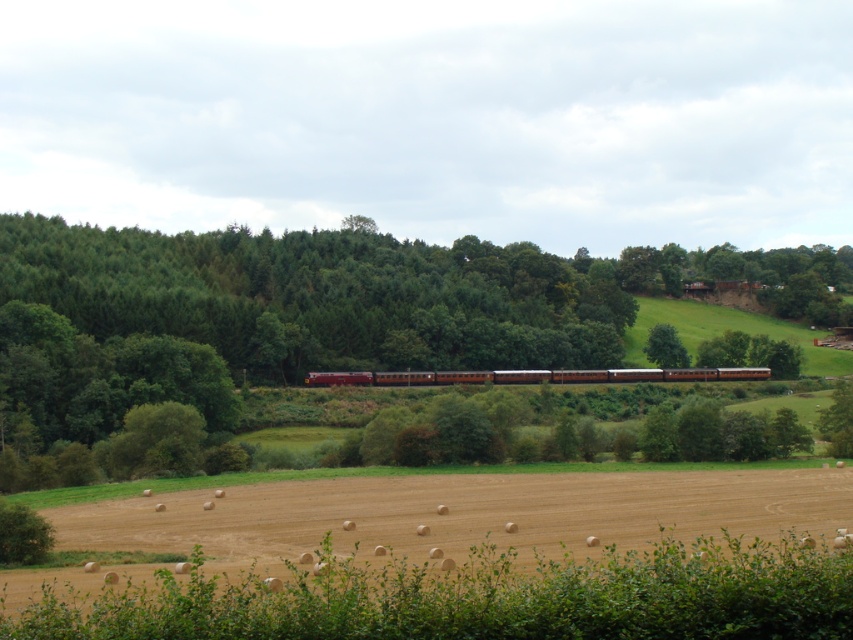
Question: Can you confirm if brown polished wood passenger train at center is positioned above green leafy tree at upper center?

Choices:
 (A) no
 (B) yes

Answer: (A)

Question: Can you confirm if green leafy tree at center is positioned below green leafy tree at upper center?

Choices:
 (A) yes
 (B) no

Answer: (B)

Question: Is green leafy tree at center above green leafy tree at upper center?

Choices:
 (A) no
 (B) yes

Answer: (B)

Question: Which of these objects is positioned farthest from the green leafy tree at upper center?

Choices:
 (A) green leafy tree at center
 (B) brown polished wood passenger train at center

Answer: (A)

Question: Which of the following is the farthest from the observer?

Choices:
 (A) green leafy tree at upper center
 (B) green leafy tree at center

Answer: (A)

Question: Estimate the real-world distances between objects in this image. Which object is closer to the green leafy tree at upper center?

Choices:
 (A) green leafy tree at center
 (B) brown polished wood passenger train at center

Answer: (B)